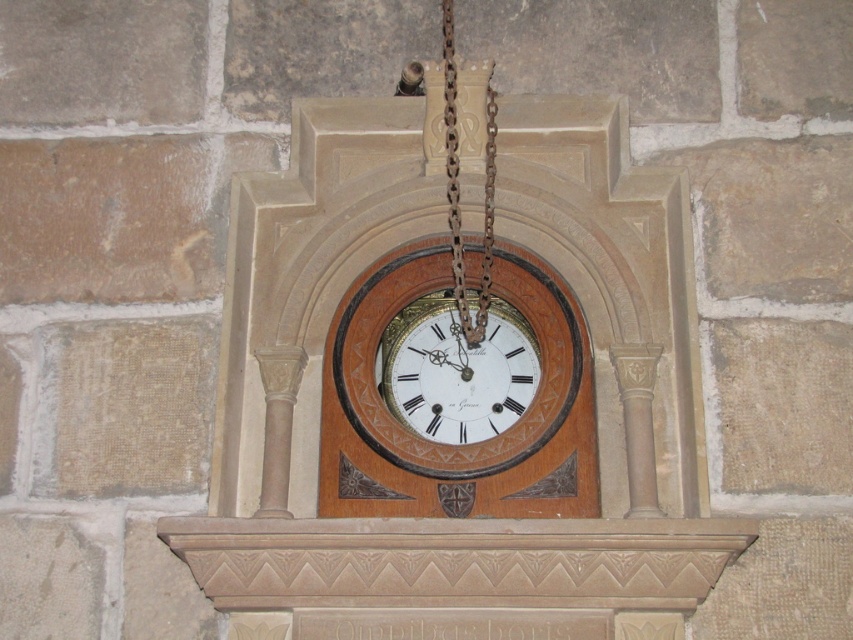
You are an interior designer planning to hang a new painting that measures 1.2 meters wide. The painting must be placed to the left of the gold metallic clock at center. Given the wall space available, can you determine if the painting will fit without overlapping the clock?

The gold metallic clock at center is positioned at point (456, 371). Since the painting must be placed to the left of the clock, the available space to the left of the clock must be at least 1.2 meters wide. However, without knowing the total width of the wall or the distance from the edge to the clock, it is impossible to determine if the painting will fit without overlapping the clock.

You are standing in front of the vintage wall clock and notice two points marked on the clock. The first point is at coordinates point [335,372] and the second is at point [461,324]. Which point is closer to you?

Point [335,372] is closer to the viewer than point [461,324].